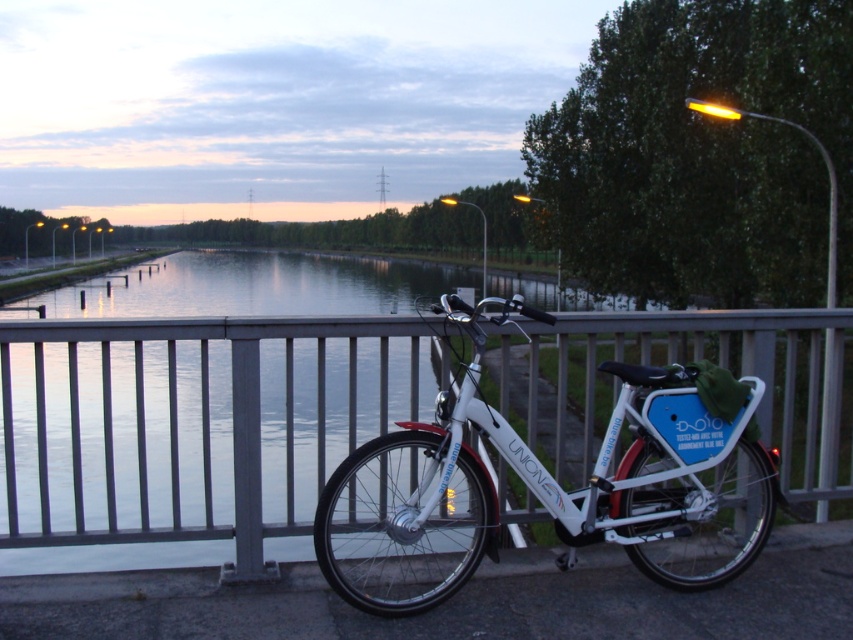
You are a GUI agent. You are given a task and a screenshot of the screen. Output one action in this format:
    pyautogui.click(x=<x>, y=<y>)
    Task: Click on the metallic silver fence at center
    The image size is (853, 640).
    Given the screenshot: What is the action you would take?
    pyautogui.click(x=189, y=428)

Who is more distant from viewer, (285, 486) or (608, 440)?

The point (285, 486) is more distant.

This screenshot has height=640, width=853. Describe the element at coordinates (189, 428) in the screenshot. I see `metallic silver fence at center` at that location.

You are a GUI agent. You are given a task and a screenshot of the screen. Output one action in this format:
    pyautogui.click(x=<x>, y=<y>)
    Task: Click on the metallic silver fence at center
    Image resolution: width=853 pixels, height=640 pixels.
    Given the screenshot: What is the action you would take?
    pyautogui.click(x=189, y=428)